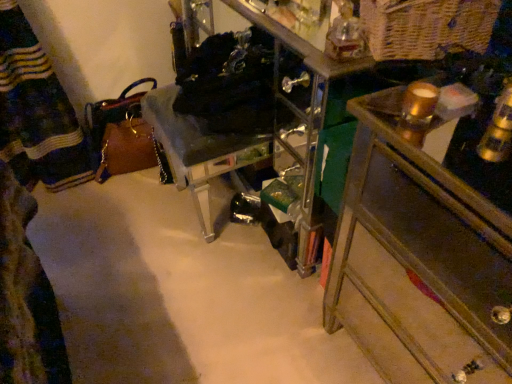
The height and width of the screenshot is (384, 512). I want to click on free location to the right of gold metallic candle at upper right, so click(x=470, y=110).